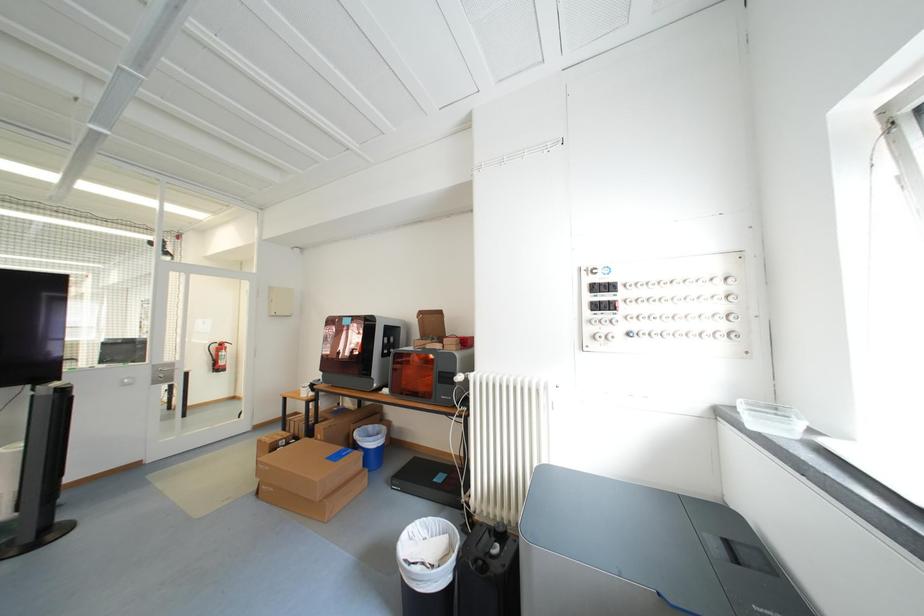
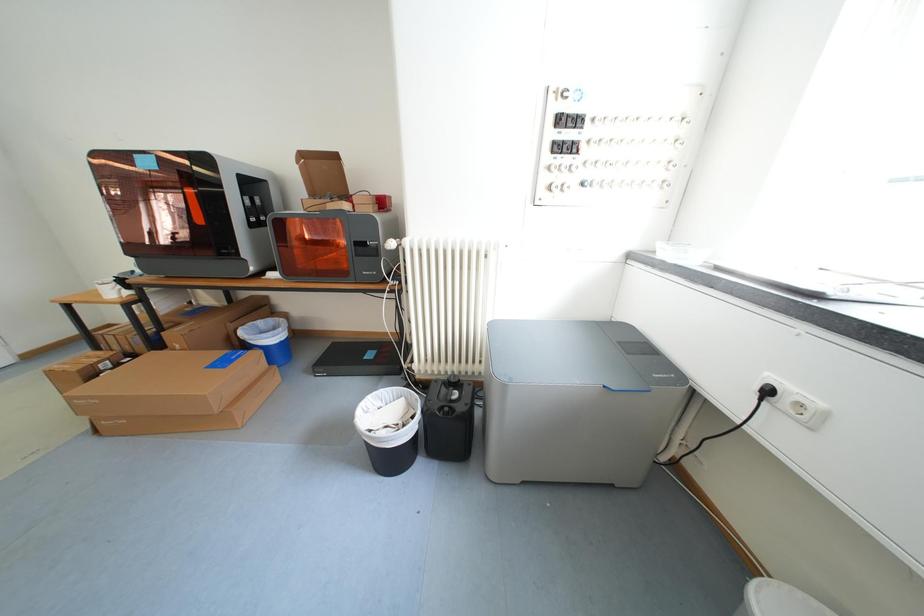
Based on the continuous images, in which direction is the camera rotating?

The rotation direction of the camera is right-down.